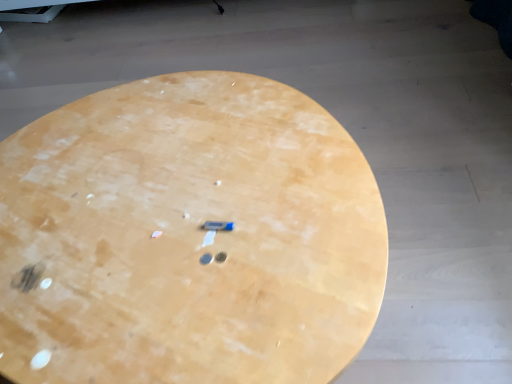
You are a GUI agent. You are given a task and a screenshot of the screen. Output one action in this format:
    pyautogui.click(x=<x>, y=<y>)
    Task: Click on the unoccupied region to the right of wooden table at center
    Image resolution: width=512 pixels, height=384 pixels.
    Given the screenshot: What is the action you would take?
    coord(432,219)